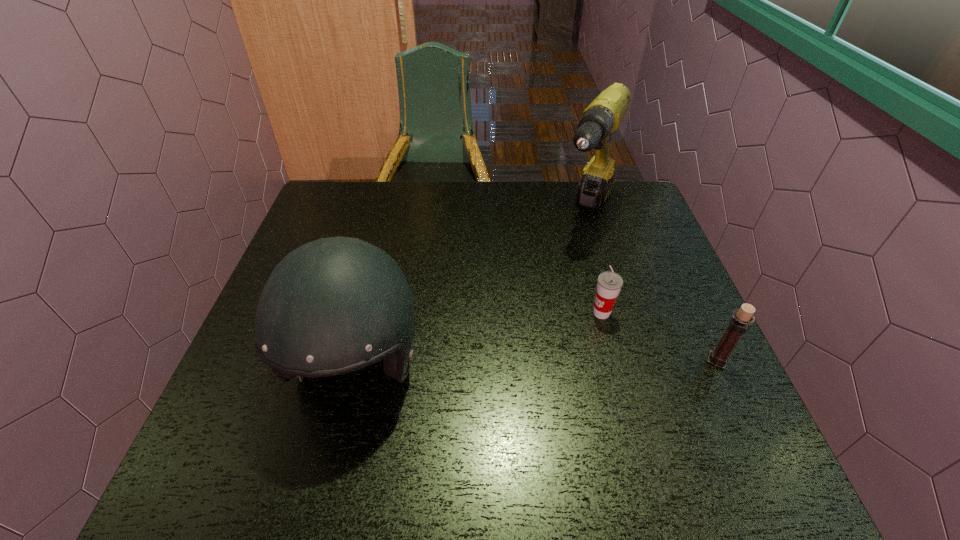
Where is `free space located 0.330m on the side of the cup with the logo`? free space located 0.330m on the side of the cup with the logo is located at coordinates (478, 386).

Where is `vacant space situated 0.120m on the side of the cup with the logo`? This screenshot has width=960, height=540. vacant space situated 0.120m on the side of the cup with the logo is located at coordinates (555, 341).

Locate an element on the screen. This screenshot has width=960, height=540. object present at the far edge is located at coordinates (602, 117).

Find the location of a particular element. The height and width of the screenshot is (540, 960). object situated at the near edge is located at coordinates (335, 305).

Locate an element on the screen. object situated at the left edge is located at coordinates (335, 305).

You are a GUI agent. You are given a task and a screenshot of the screen. Output one action in this format:
    pyautogui.click(x=<x>, y=<y>)
    Task: Click on the candle holder that is positioned at the right edge
    
    Given the screenshot: What is the action you would take?
    pyautogui.click(x=738, y=325)

Find the location of a particular element. Image resolution: width=960 pixels, height=540 pixels. drill present at the right edge is located at coordinates (602, 117).

At what (x,y) coordinates should I click in order to perform the action: click on object present at the near left corner. Please return your answer as a coordinate pair (x, y). Looking at the image, I should click on (335, 305).

At what (x,y) coordinates should I click in order to perform the action: click on object situated at the far right corner. Please return your answer as a coordinate pair (x, y). Looking at the image, I should click on (602, 117).

Identify the location of free region at the far edge. pos(508,213).